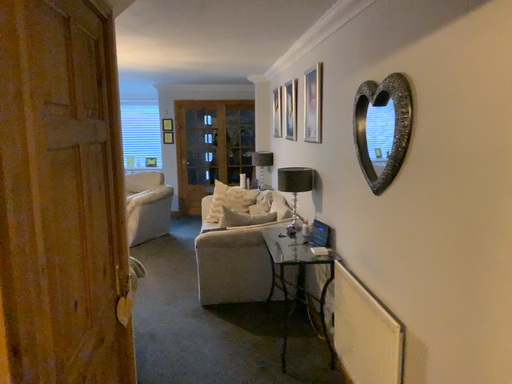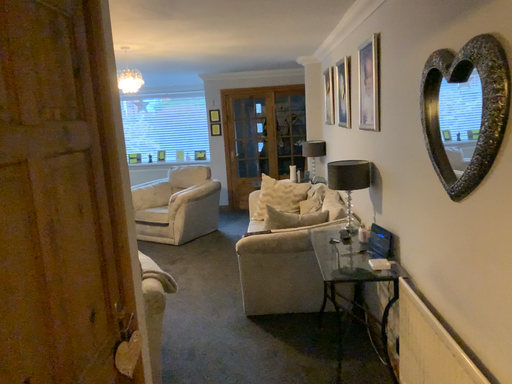
Question: Which way did the camera rotate in the video?

Choices:
 (A) rotated left
 (B) rotated right

Answer: (A)